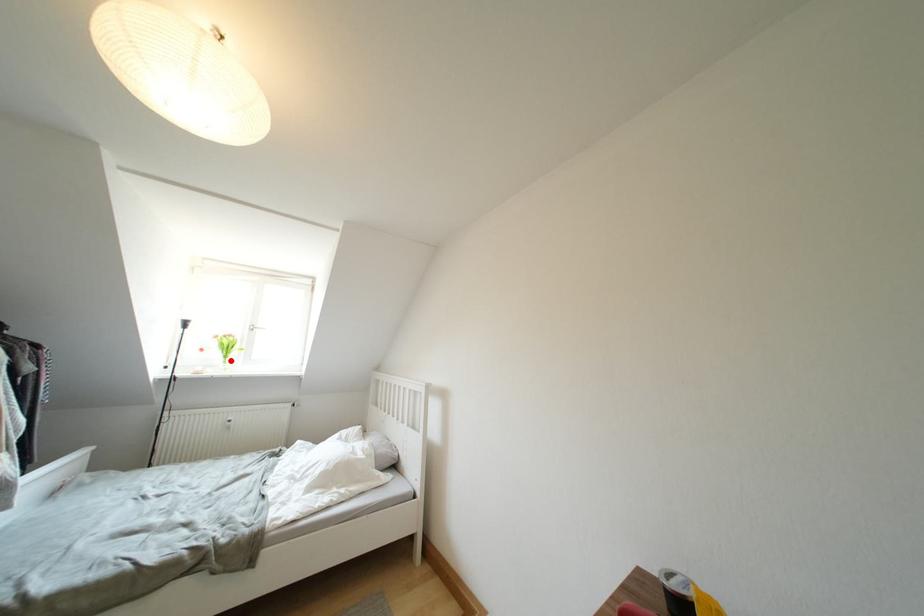
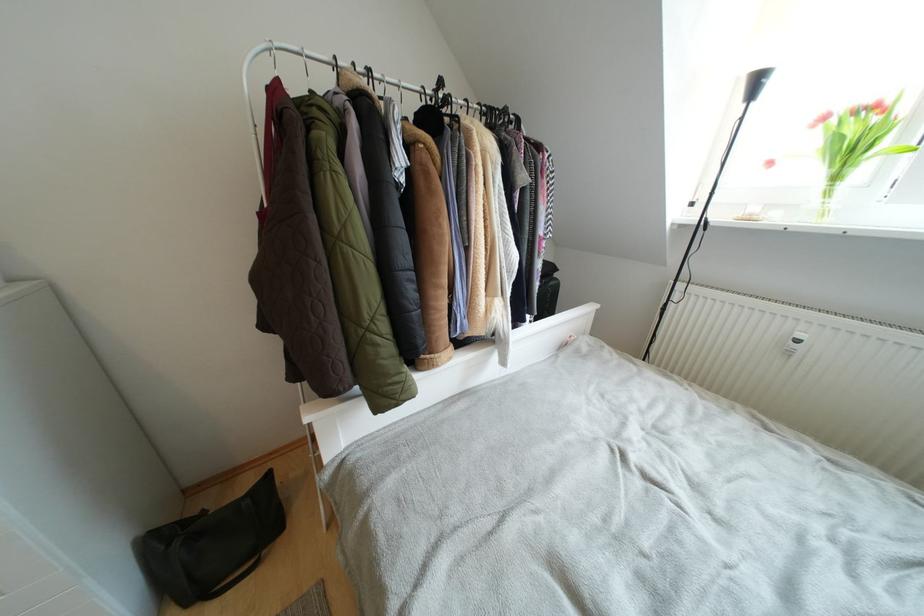
The point at the highlighted location is marked in the first image. Where is the corresponding point in the second image?

(840, 182)